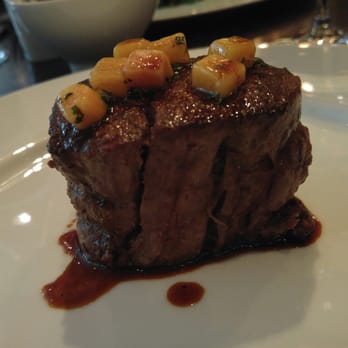
Locate an element on the screen. table is located at coordinates (18, 80).